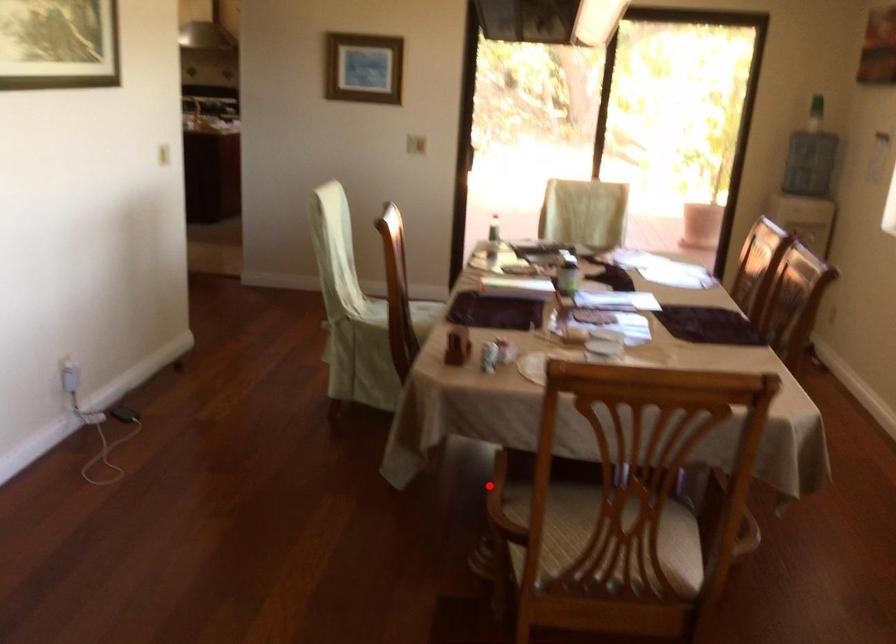
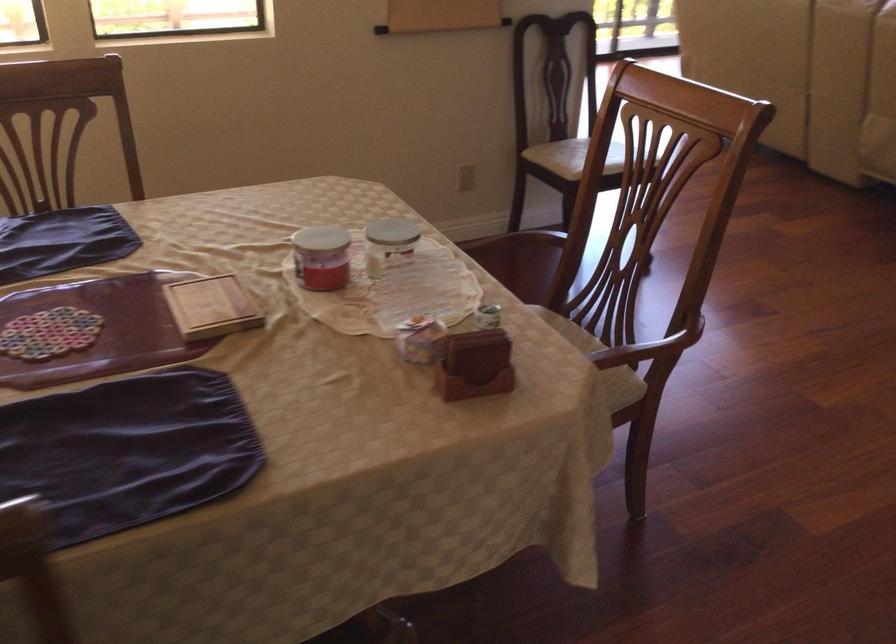
Question: A red point is marked in image1. In image2, is the corresponding 3D point closer to the camera or farther? Reply with the corresponding letter.

Choices:
 (A) The corresponding 3D point is closer.
 (B) The corresponding 3D point is farther.

Answer: (A)